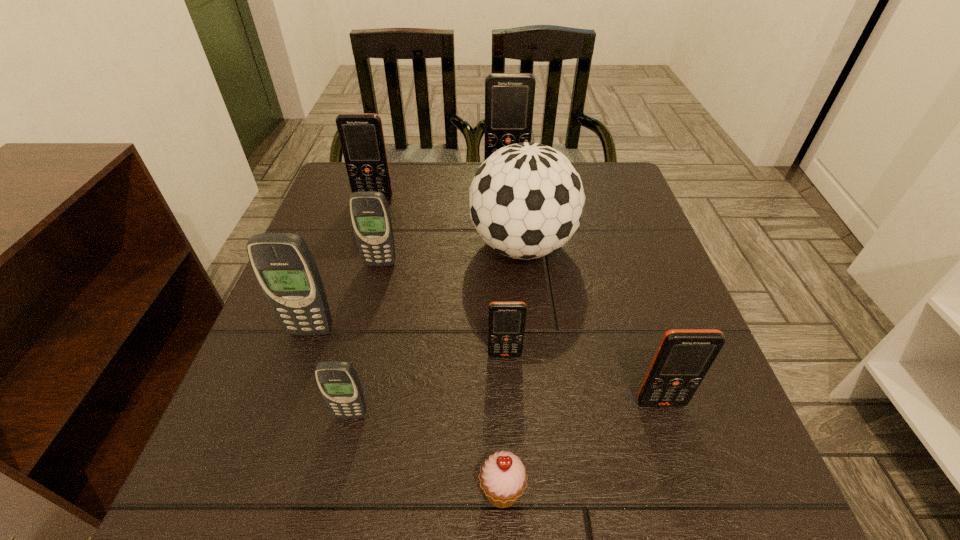
Locate an element on the screen. The width and height of the screenshot is (960, 540). the second nearest cellular telephone is located at coordinates (684, 356).

You are a GUI agent. You are given a task and a screenshot of the screen. Output one action in this format:
    pyautogui.click(x=<x>, y=<y>)
    Task: Click on the second nearest orange cellular telephone
    
    Given the screenshot: What is the action you would take?
    pyautogui.click(x=506, y=320)

The width and height of the screenshot is (960, 540). Identify the location of the fourth nearest object. (506, 320).

Where is `the nearest cellular telephone`? the nearest cellular telephone is located at coordinates (338, 382).

Find the location of `the nearest gray cellular telephone`. the nearest gray cellular telephone is located at coordinates (338, 382).

This screenshot has width=960, height=540. What are the coordinates of `the nearest object` in the screenshot? It's located at (503, 478).

The image size is (960, 540). Identify the location of cupcake. pos(503,478).

Identify the location of vacant area situated 0.400m on the screen of the farthest object. The image size is (960, 540). (515, 279).

The height and width of the screenshot is (540, 960). What are the coordinates of `vacant point located on the front of the soccer ball` in the screenshot? It's located at (534, 355).

At what (x,y) coordinates should I click in order to perform the action: click on vacant space located on the screen of the second farthest object. Please return your answer as a coordinate pair (x, y). The image size is (960, 540). Looking at the image, I should click on (352, 268).